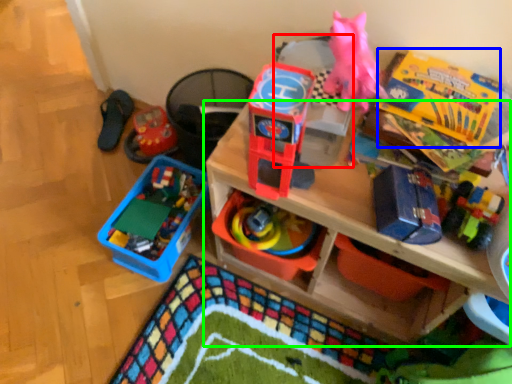
Question: Considering the real-world distances, which object is farthest from storage box (highlighted by a red box)? storage box (highlighted by a blue box) or shelf (highlighted by a green box)?

Choices:
 (A) storage box
 (B) shelf

Answer: (B)